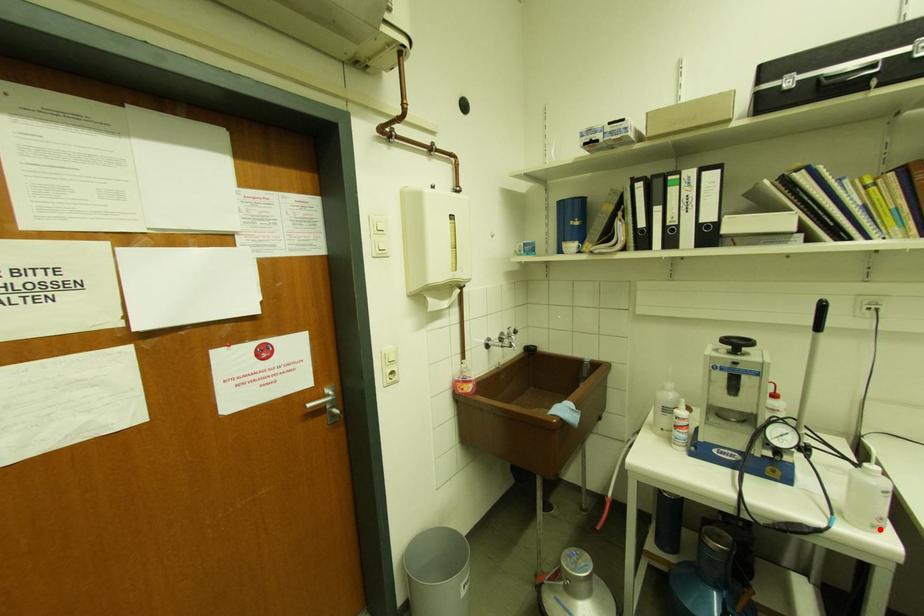
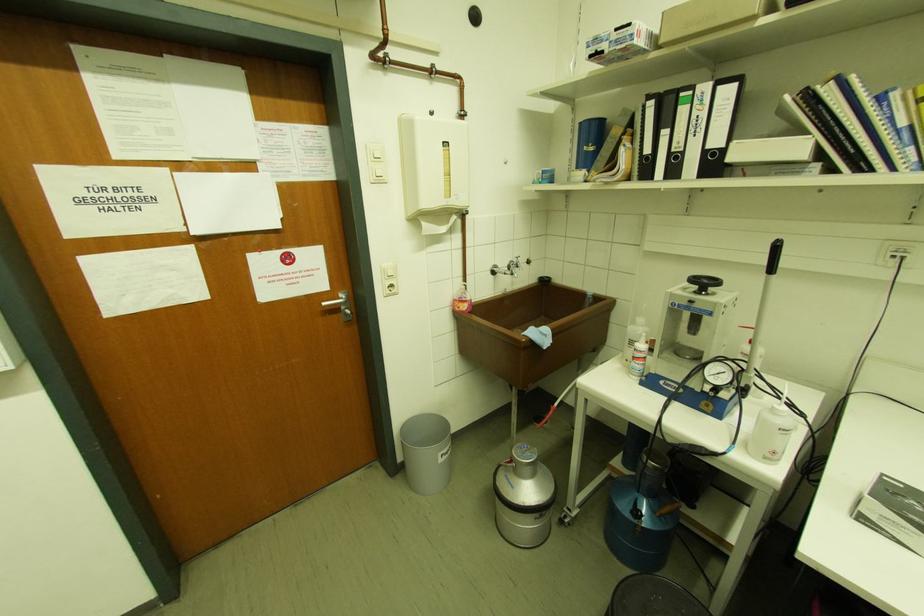
Locate, in the second image, the point that corresponds to the highlighted location in the first image.

(772, 460)